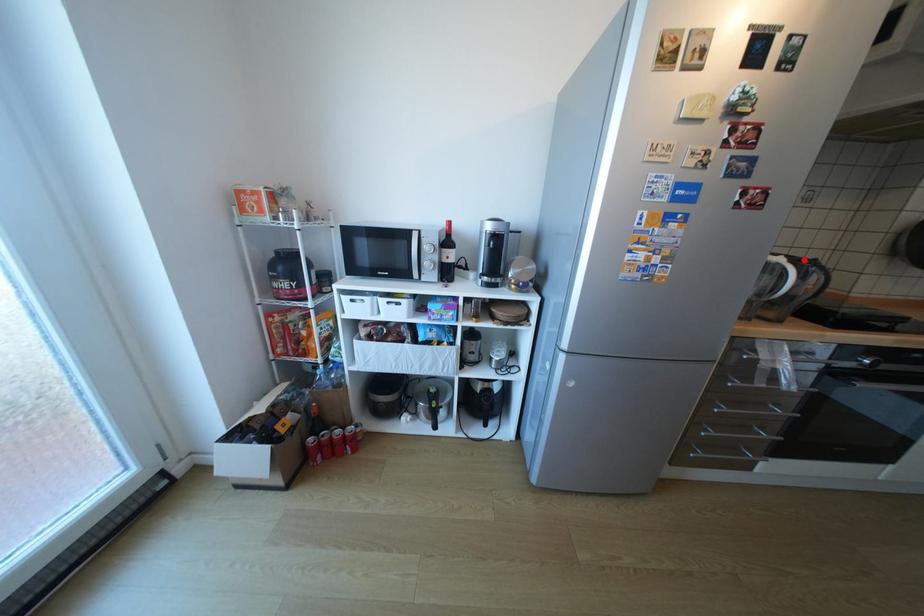
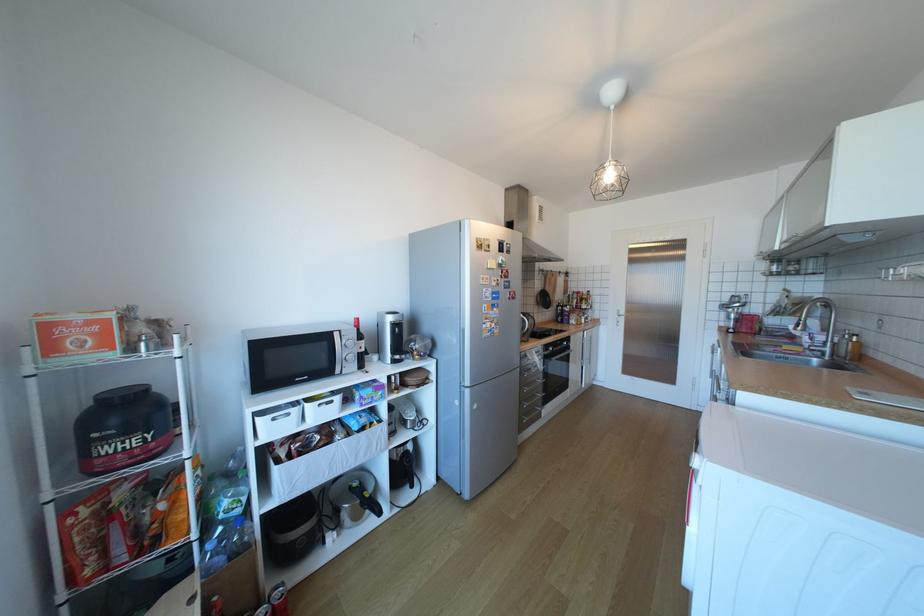
Locate, in the second image, the point that corresponds to the highlighted location in the first image.

(532, 314)